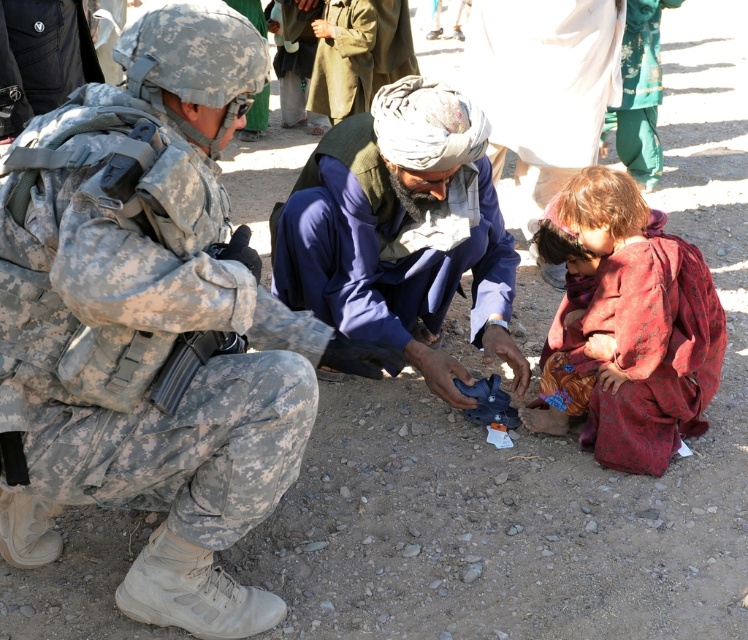
Question: Which point is farther from the camera taking this photo?

Choices:
 (A) (248, 442)
 (B) (646, 317)

Answer: (B)

Question: Does camouflage fabric uniform at left have a greater width compared to red fabric dress at lower right?

Choices:
 (A) no
 (B) yes

Answer: (B)

Question: Is camouflage fabric uniform at left thinner than red fabric dress at lower right?

Choices:
 (A) no
 (B) yes

Answer: (A)

Question: Estimate the real-world distances between objects in this image. Which object is farther from the camouflage fabric uniform at left?

Choices:
 (A) red fabric dress at lower right
 (B) blue fabric turban at center

Answer: (A)

Question: Which object is positioned farthest from the red fabric dress at lower right?

Choices:
 (A) camouflage fabric uniform at left
 (B) blue fabric turban at center

Answer: (A)

Question: Can you confirm if blue fabric turban at center is positioned above red fabric dress at lower right?

Choices:
 (A) no
 (B) yes

Answer: (B)